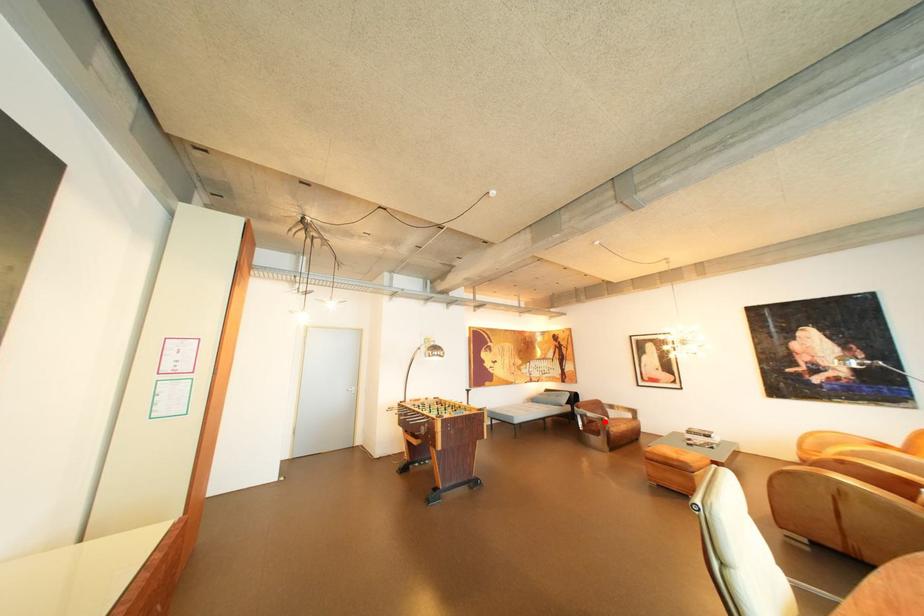
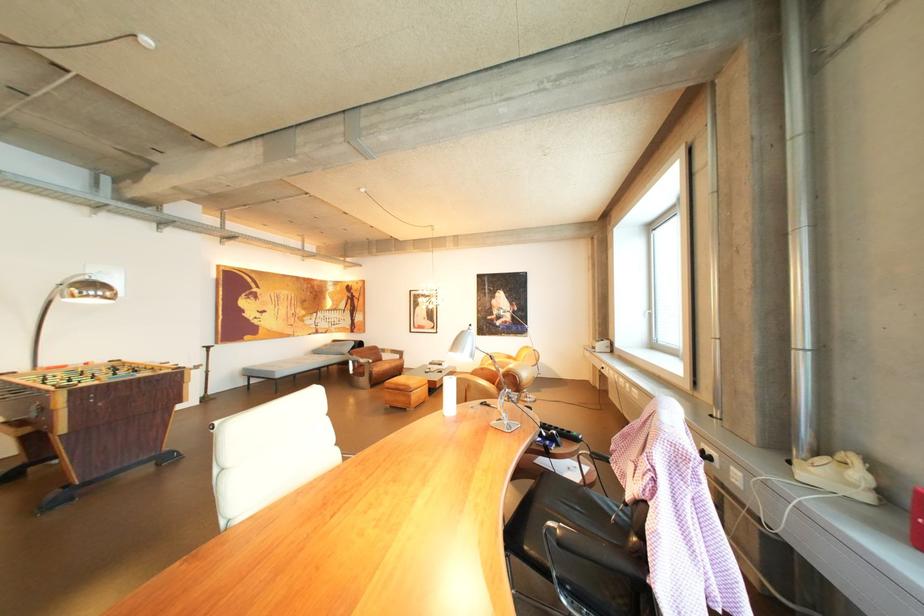
Question: I am providing you with two images of the same scene from different viewpoints. In image1, a red point is highlighted. Considering the same 3D point in image2, which of the following is correct?

Choices:
 (A) It is closer
 (B) It is farther

Answer: (A)